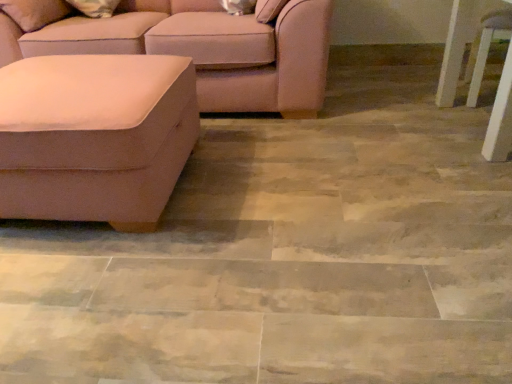
Question: From a real-world perspective, is suede-like beige ottoman at left, which ranks as the 1th studio couch in front-to-back order, under suede-like beige couch at left, the 2th studio couch in the front-to-back sequence?

Choices:
 (A) no
 (B) yes

Answer: (B)

Question: Is suede-like beige ottoman at left, positioned as the 2th studio couch in back-to-front order, far away from suede-like beige couch at left, which is counted as the first studio couch, starting from the back?

Choices:
 (A) no
 (B) yes

Answer: (A)

Question: Considering the relative sizes of suede-like beige ottoman at left, which ranks as the 1th studio couch in front-to-back order, and suede-like beige couch at left, the 2th studio couch in the front-to-back sequence, in the image provided, is suede-like beige ottoman at left, which ranks as the 1th studio couch in front-to-back order, taller than suede-like beige couch at left, the 2th studio couch in the front-to-back sequence,?

Choices:
 (A) yes
 (B) no

Answer: (B)

Question: From the image's perspective, is suede-like beige ottoman at left, positioned as the 2th studio couch in back-to-front order, below suede-like beige couch at left, which is counted as the first studio couch, starting from the back?

Choices:
 (A) yes
 (B) no

Answer: (A)

Question: Can we say suede-like beige ottoman at left, positioned as the 2th studio couch in back-to-front order, lies outside suede-like beige couch at left, which is counted as the first studio couch, starting from the back?

Choices:
 (A) yes
 (B) no

Answer: (A)

Question: From a real-world perspective, is suede-like beige ottoman at left, which ranks as the 1th studio couch in front-to-back order, positioned above or below white glossy side table at right?

Choices:
 (A) below
 (B) above

Answer: (A)

Question: Looking at their shapes, would you say suede-like beige ottoman at left, which ranks as the 1th studio couch in front-to-back order, is wider or thinner than white glossy side table at right?

Choices:
 (A) wide
 (B) thin

Answer: (A)

Question: In terms of size, does suede-like beige ottoman at left, positioned as the 2th studio couch in back-to-front order, appear bigger or smaller than white glossy side table at right?

Choices:
 (A) small
 (B) big

Answer: (B)

Question: Considering the relative positions of suede-like beige ottoman at left, positioned as the 2th studio couch in back-to-front order, and white glossy side table at right in the image provided, is suede-like beige ottoman at left, positioned as the 2th studio couch in back-to-front order, to the left or to the right of white glossy side table at right?

Choices:
 (A) right
 (B) left

Answer: (B)

Question: From a real-world perspective, is suede-like beige couch at left, the 2th studio couch in the front-to-back sequence, above or below white glossy side table at right?

Choices:
 (A) above
 (B) below

Answer: (A)

Question: Considering the positions of suede-like beige couch at left, which is counted as the first studio couch, starting from the back, and white glossy side table at right in the image, is suede-like beige couch at left, which is counted as the first studio couch, starting from the back, wider or thinner than white glossy side table at right?

Choices:
 (A) thin
 (B) wide

Answer: (B)

Question: In terms of size, does suede-like beige couch at left, which is counted as the first studio couch, starting from the back, appear bigger or smaller than white glossy side table at right?

Choices:
 (A) big
 (B) small

Answer: (A)

Question: Does point (233, 84) appear closer or farther from the camera than point (458, 59)?

Choices:
 (A) farther
 (B) closer

Answer: (B)

Question: Choose the correct answer: Is suede-like beige couch at left, which is counted as the first studio couch, starting from the back, inside suede-like beige ottoman at left, which ranks as the 1th studio couch in front-to-back order, or outside it?

Choices:
 (A) outside
 (B) inside

Answer: (A)

Question: Relative to suede-like beige ottoman at left, which ranks as the 1th studio couch in front-to-back order, is suede-like beige couch at left, the 2th studio couch in the front-to-back sequence, in front or behind?

Choices:
 (A) front
 (B) behind

Answer: (B)